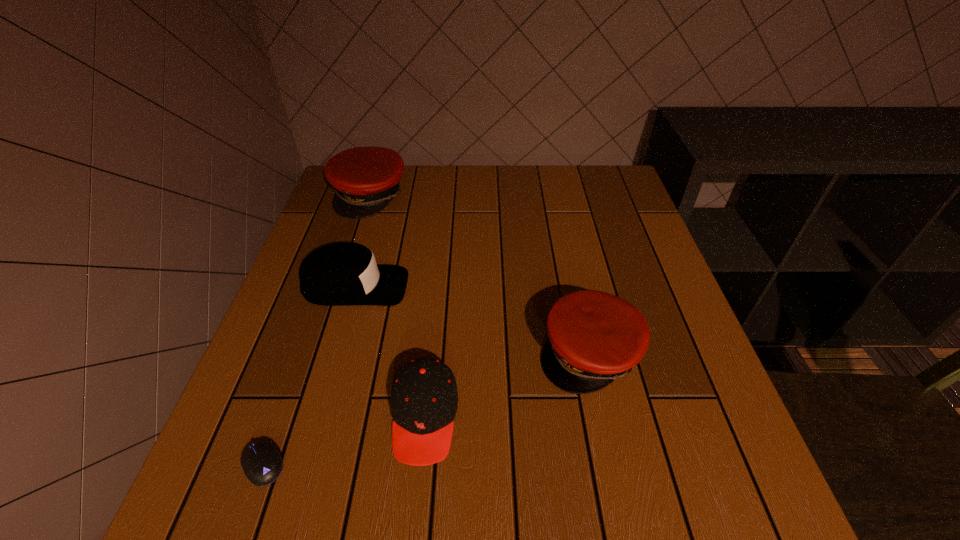
Image resolution: width=960 pixels, height=540 pixels. What are the coordinates of `blank space at the near right corner of the desktop` in the screenshot? It's located at (717, 503).

Where is `free spot between the computer mouse and the farthest cap`? Image resolution: width=960 pixels, height=540 pixels. free spot between the computer mouse and the farthest cap is located at coordinates (317, 330).

This screenshot has height=540, width=960. Identify the location of blank region between the second farthest object and the farthest object. (363, 241).

Locate an element on the screen. The image size is (960, 540). free area in between the farthest object and the third nearest cap is located at coordinates (363, 241).

Identify the location of blank region between the second cap from right to left and the computer mouse. (344, 441).

At what (x,y) coordinates should I click in order to perform the action: click on free space between the computer mouse and the third nearest cap. Please return your answer as a coordinate pair (x, y). This screenshot has height=540, width=960. Looking at the image, I should click on (309, 375).

Where is `vacant point located between the farthest cap and the computer mouse`? vacant point located between the farthest cap and the computer mouse is located at coordinates pos(317,330).

Find the location of `free space between the third cap from left to right and the computer mouse`. free space between the third cap from left to right and the computer mouse is located at coordinates (344, 441).

Where is `blank region between the second farthest object and the rightmost cap`? Image resolution: width=960 pixels, height=540 pixels. blank region between the second farthest object and the rightmost cap is located at coordinates (472, 320).

Locate an element on the screen. This screenshot has height=540, width=960. free space between the farthest object and the third cap from left to right is located at coordinates (397, 306).